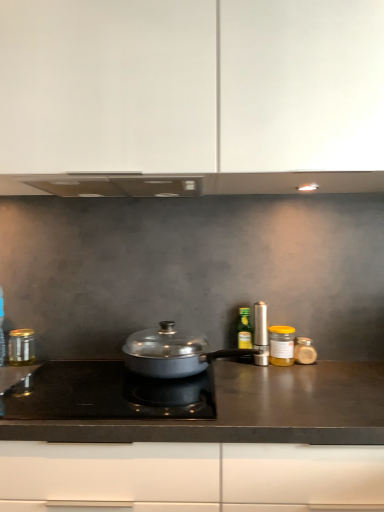
Identify the location of vacant space that is to the left of matte silver pan at center, which appears as the second kitchen appliance when viewed from the left. (62, 378).